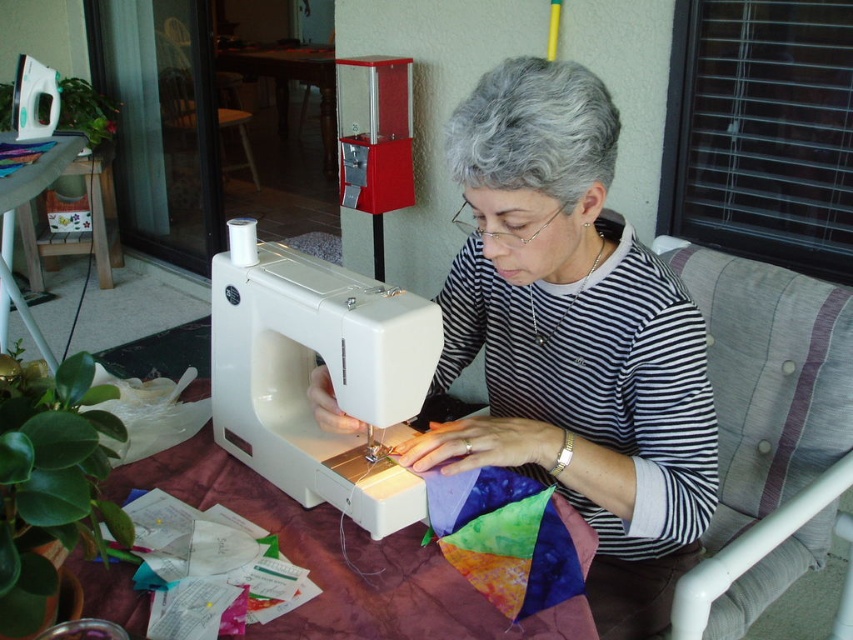
Question: Is striped fabric shirt at center bigger than white plastic sewing machine at center?

Choices:
 (A) yes
 (B) no

Answer: (A)

Question: Can you confirm if striped fabric shirt at center is smaller than white plastic sewing machine at center?

Choices:
 (A) yes
 (B) no

Answer: (B)

Question: Which of the following is the farthest from the observer?

Choices:
 (A) (241, 285)
 (B) (587, 445)

Answer: (A)

Question: Can you confirm if striped fabric shirt at center is positioned to the left of white plastic sewing machine at center?

Choices:
 (A) yes
 (B) no

Answer: (B)

Question: Which object is closer to the camera taking this photo?

Choices:
 (A) striped fabric shirt at center
 (B) white plastic sewing machine at center

Answer: (B)